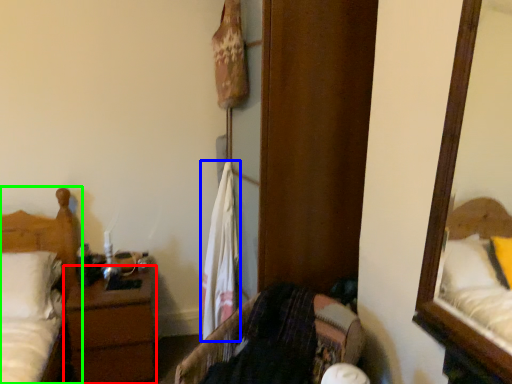
Question: Which is farther away from nightstand (highlighted by a red box)? laundry (highlighted by a blue box) or bed (highlighted by a green box)?

Choices:
 (A) laundry
 (B) bed

Answer: (A)